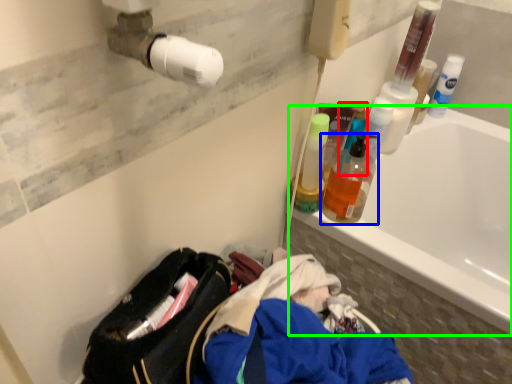
Question: Estimate the real-world distances between objects in this image. Which object is farther from cleaning product (highlighted by a red box), bottle (highlighted by a blue box) or bathtub (highlighted by a green box)?

Choices:
 (A) bottle
 (B) bathtub

Answer: (B)